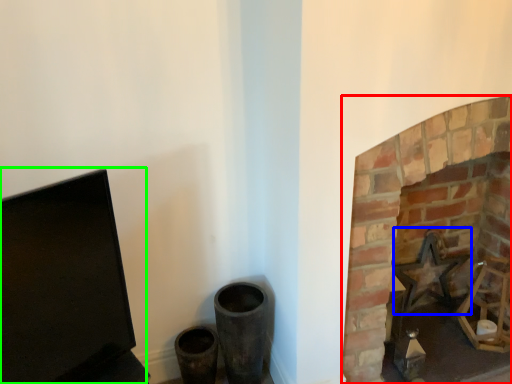
Question: Considering the real-world distances, which object is closest to fireplace (highlighted by a red box)? swivel chair (highlighted by a blue box) or computer monitor (highlighted by a green box).

Choices:
 (A) swivel chair
 (B) computer monitor

Answer: (A)